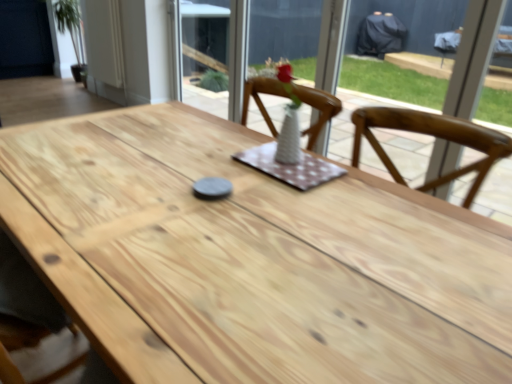
Question: Is natural wood table at center taller than white glass vase at upper center?

Choices:
 (A) yes
 (B) no

Answer: (B)

Question: From a real-world perspective, is natural wood table at center positioned under white glass vase at upper center based on gravity?

Choices:
 (A) no
 (B) yes

Answer: (B)

Question: Does natural wood table at center lie behind white glass vase at upper center?

Choices:
 (A) yes
 (B) no

Answer: (B)

Question: From the image's perspective, is natural wood table at center located above white glass vase at upper center?

Choices:
 (A) yes
 (B) no

Answer: (B)

Question: Is natural wood table at center shorter than white glass vase at upper center?

Choices:
 (A) yes
 (B) no

Answer: (A)

Question: Does natural wood table at center come in front of white glass vase at upper center?

Choices:
 (A) no
 (B) yes

Answer: (B)

Question: From the image's perspective, is white glass vase at upper center under white wood door at upper left?

Choices:
 (A) no
 (B) yes

Answer: (B)

Question: From a real-world perspective, is white glass vase at upper center on white wood door at upper left?

Choices:
 (A) yes
 (B) no

Answer: (A)

Question: Is white glass vase at upper center next to white wood door at upper left and touching it?

Choices:
 (A) yes
 (B) no

Answer: (B)

Question: Could you tell me if white glass vase at upper center is turned towards white wood door at upper left?

Choices:
 (A) yes
 (B) no

Answer: (B)

Question: Is white glass vase at upper center located outside white wood door at upper left?

Choices:
 (A) no
 (B) yes

Answer: (B)

Question: Is white glass vase at upper center not near white wood door at upper left?

Choices:
 (A) no
 (B) yes

Answer: (B)

Question: Is white ceramic vase at center looking in the opposite direction of natural wood table at center?

Choices:
 (A) yes
 (B) no

Answer: (B)